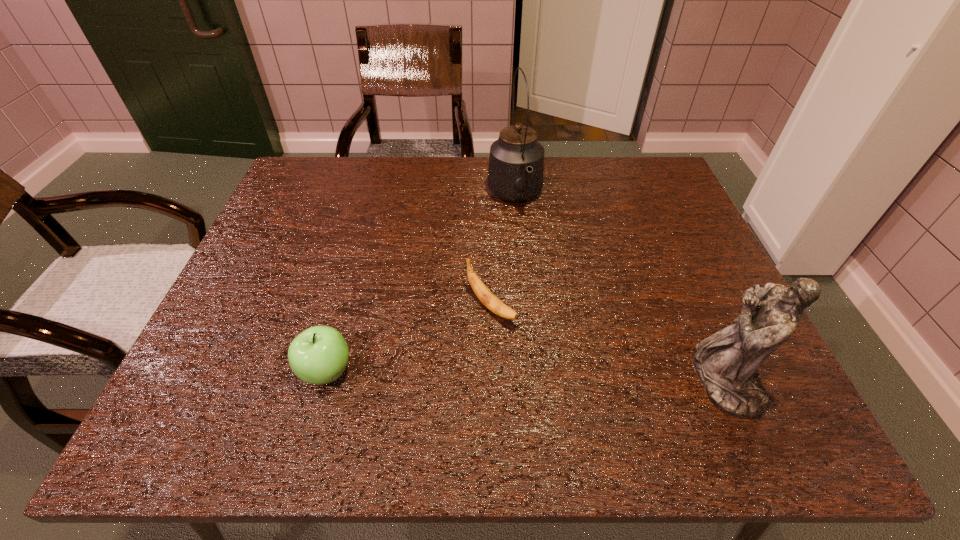
At what (x,y) coordinates should I click in order to perform the action: click on vacant space on the desktop that is between the third tallest object and the figurine and is positioned spout on the kettle. Please return your answer as a coordinate pair (x, y). The width and height of the screenshot is (960, 540). Looking at the image, I should click on (581, 377).

You are a GUI agent. You are given a task and a screenshot of the screen. Output one action in this format:
    pyautogui.click(x=<x>, y=<y>)
    Task: Click on the vacant space on the desktop that is between the apple and the rightmost object and is positioned on the peel of the shortest object from the top
    The image size is (960, 540).
    Given the screenshot: What is the action you would take?
    pyautogui.click(x=565, y=376)